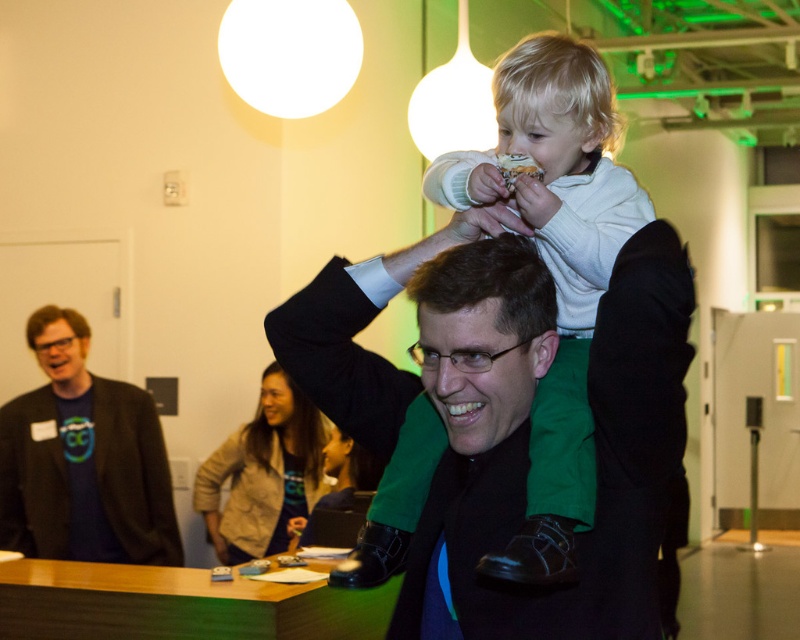
Question: Is dark blue shirt at left wider than smooth brown hair at center?

Choices:
 (A) no
 (B) yes

Answer: (B)

Question: Which point is closer to the camera?

Choices:
 (A) (522, 321)
 (B) (582, 147)
 (C) (533, 138)

Answer: (A)

Question: Can you confirm if light brown fabric jacket at center is positioned above matte black glasses at upper left?

Choices:
 (A) yes
 (B) no

Answer: (B)

Question: Is green fabric head at center smaller than smooth brown hair at center?

Choices:
 (A) no
 (B) yes

Answer: (B)

Question: Which point is farther from the camera taking this photo?

Choices:
 (A) (504, 305)
 (B) (206, 518)
 (C) (144, 433)
 (D) (454, 364)

Answer: (B)

Question: Among these objects, which one is farthest from the camera?

Choices:
 (A) smooth brown hair at center
 (B) dark blue shirt at left
 (C) blonde hair at upper center
 (D) matte black glasses at upper left

Answer: (A)